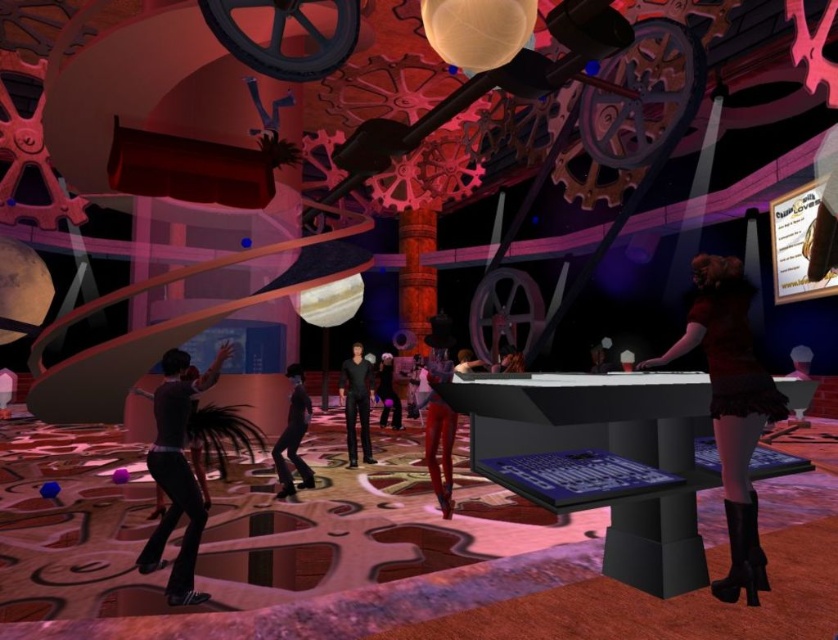
You are a fashion designer attending a virtual runway show and see the velvet red dress at right and the shiny black suit at center left. Which outfit has a wider silhouette?

The velvet red dress at right has a wider silhouette than the shiny black suit at center left.

You are a character in this virtual world and need to move from the shiny black suit at center left to the shiny red pants at center. Can you reach them in one jump if your maximum jump distance is 7 feet?

The distance between the shiny black suit at center left and the shiny red pants at center is 7.23 feet, which exceeds your maximum jump distance of 7 feet. Therefore, you cannot reach them in one jump.

From the picture: You are attending a virtual gala and notice two guests dressed in the velvet red dress at right and the shiny black suit at center left. Which guest is taller?

The velvet red dress at right is taller than the shiny black suit at center left, so the guest wearing the velvet red dress at right is taller.